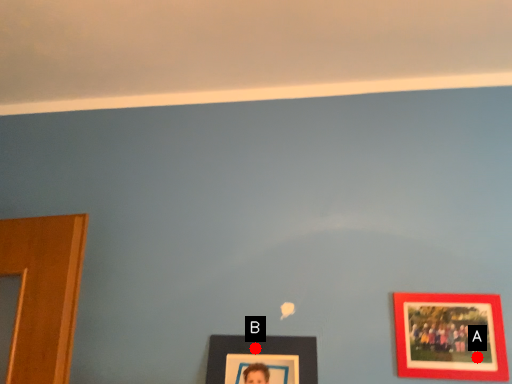
Question: Two points are circled on the image, labeled by A and B beside each circle. Which point is farther to the camera?

Choices:
 (A) A is further
 (B) B is further

Answer: (B)